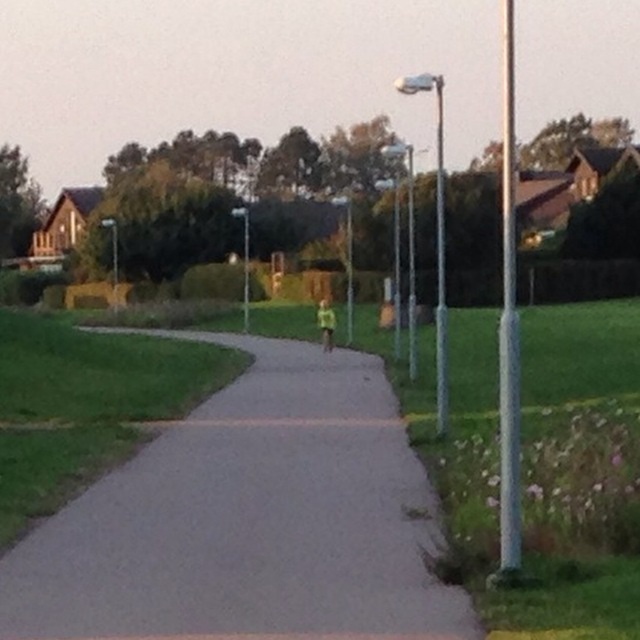
You are a pedestrian walking along the gray asphalt path at center. You notice a silver metallic pole at right nearby. Which object occupies more space in the image?

The silver metallic pole at right occupies more space in the image than the gray asphalt path at center, as the pole is described as larger.

You are a city planner assessing the layout of this outdoor area. You need to determine if the silver metallic pole at right can accommodate a larger decorative fixture compared to the metallic pole at center. Based on the scene, what can you conclude?

The silver metallic pole at right is wider than the metallic pole at center, so it can accommodate a larger decorative fixture.